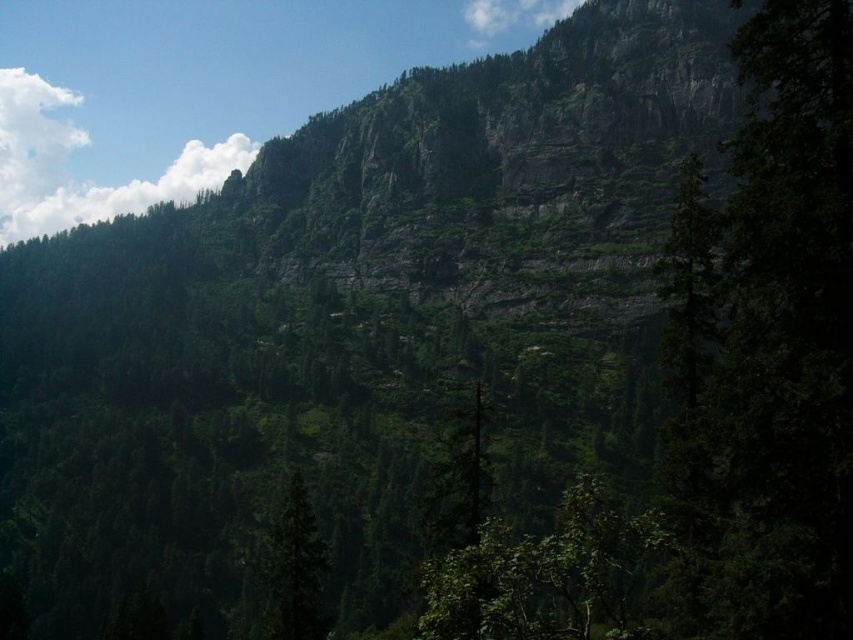
Does white fluffy cloud at upper left have a smaller size compared to green matte tree at center?

No, white fluffy cloud at upper left is not smaller than green matte tree at center.

Can you confirm if white fluffy cloud at upper left is positioned above green matte tree at center?

Yes, white fluffy cloud at upper left is above green matte tree at center.

Which is behind, point (10, 112) or point (312, 566)?

Positioned behind is point (10, 112).

Identify the location of white fluffy cloud at upper left. (70, 156).

Can you confirm if green matte tree at center is positioned above white fluffy cloud at upper center?

Incorrect, green matte tree at center is not positioned above white fluffy cloud at upper center.

Does green matte tree at center have a lesser height compared to white fluffy cloud at upper center?

Indeed, green matte tree at center has a lesser height compared to white fluffy cloud at upper center.

Identify the location of green matte tree at center. Image resolution: width=853 pixels, height=640 pixels. point(294,570).

Identify the location of green matte tree at center. The image size is (853, 640). (294, 570).

This screenshot has width=853, height=640. What do you see at coordinates (70, 156) in the screenshot?
I see `white fluffy cloud at upper left` at bounding box center [70, 156].

Measure the distance from white fluffy cloud at upper left to white fluffy cloud at upper center.

428.34 feet

Where is `white fluffy cloud at upper left`? The width and height of the screenshot is (853, 640). white fluffy cloud at upper left is located at coordinates (70, 156).